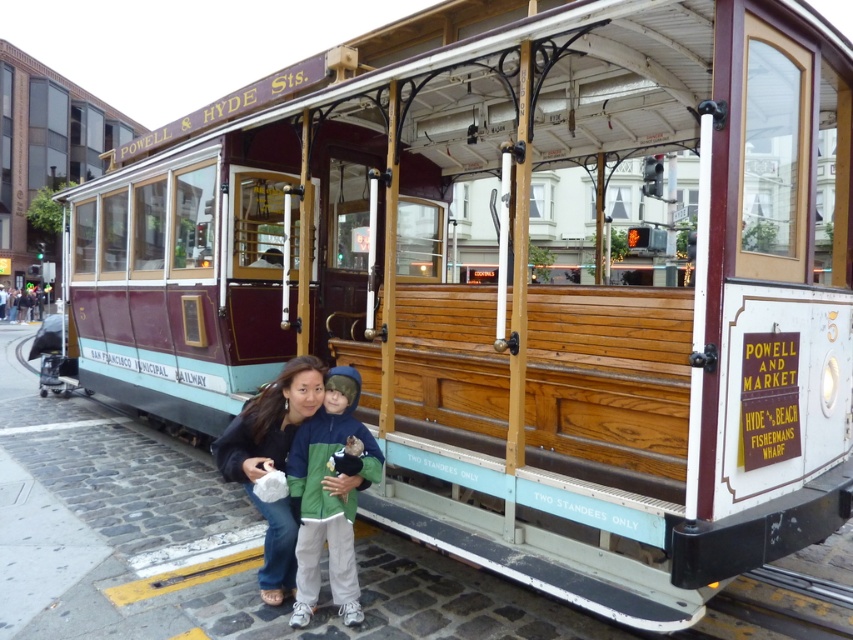
Can you confirm if green fleece jacket at center is thinner than matte black jacket at lower center?

Correct, green fleece jacket at center's width is less than matte black jacket at lower center's.

Which is below, green fleece jacket at center or matte black jacket at lower center?

green fleece jacket at center is lower down.

Who is more forward, (309,554) or (259,401)?

Point (309,554) is in front.

Locate an element on the screen. Image resolution: width=853 pixels, height=640 pixels. green fleece jacket at center is located at coordinates (329, 496).